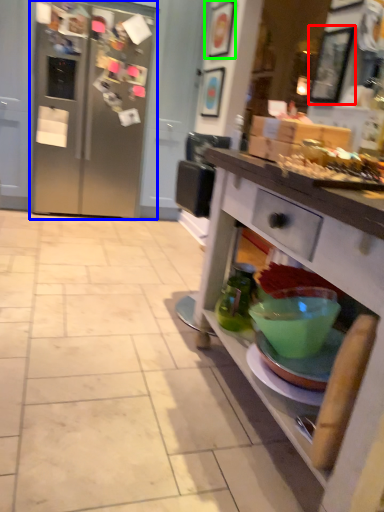
Question: Based on their relative distances, which object is nearer to picture frame (highlighted by a red box)? Choose from refrigerator (highlighted by a blue box) and picture frame (highlighted by a green box).

Choices:
 (A) refrigerator
 (B) picture frame

Answer: (B)